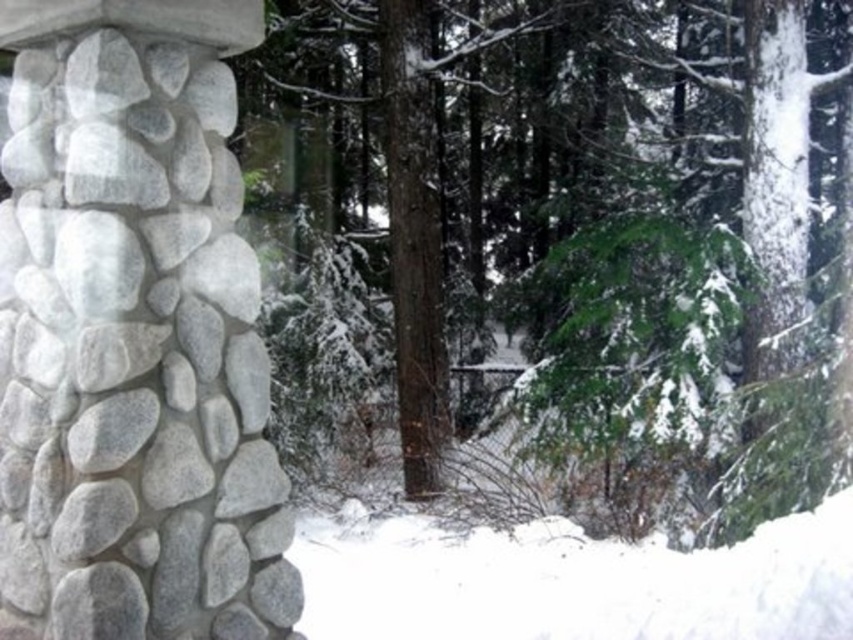
Based on the coordinates provided in the scene, where is the green textured evergreen tree at center located?

The green textured evergreen tree at center is located at coordinates point (578, 252).

You are an architect examining the winter scene. You need to determine which object, the gray stone column at left or the white fluffy snow at lower center, would require more vertical space in a scaled model. Based on the scene, which one should you allocate more height to in your model?

The gray stone column at left is much taller than the white fluffy snow at lower center, so you should allocate more vertical space to the gray stone column at left in your model.

You are a hiker planning to cross the area between the green textured evergreen tree at center and the gray stone column at left. The path you want to take is 8 meters long. Will you be able to traverse this path without needing to adjust your route?

The distance between the green textured evergreen tree at center and the gray stone column at left is 7.93 meters, which is slightly shorter than the 8 meters path you plan to take. Therefore, you will need to adjust your route to accommodate the shorter distance.